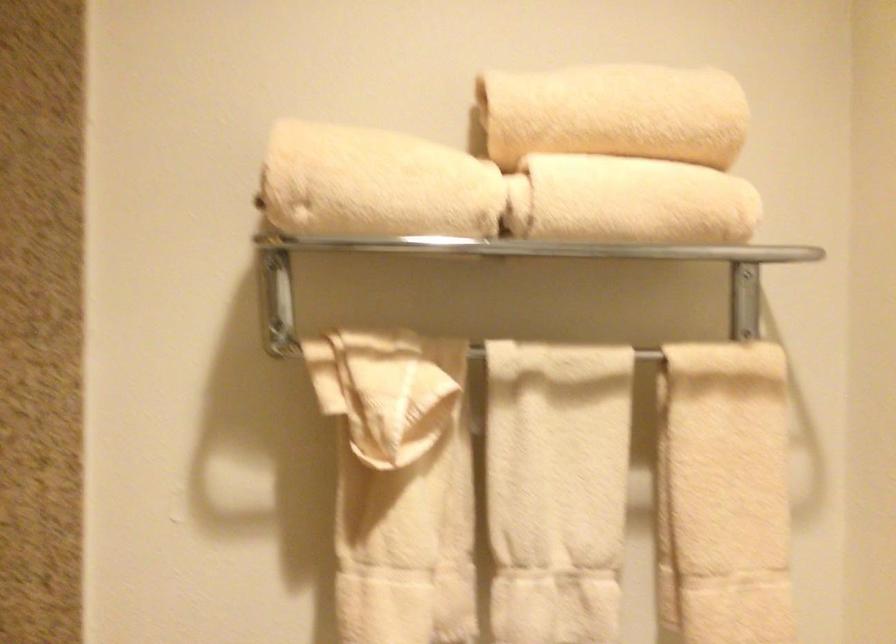
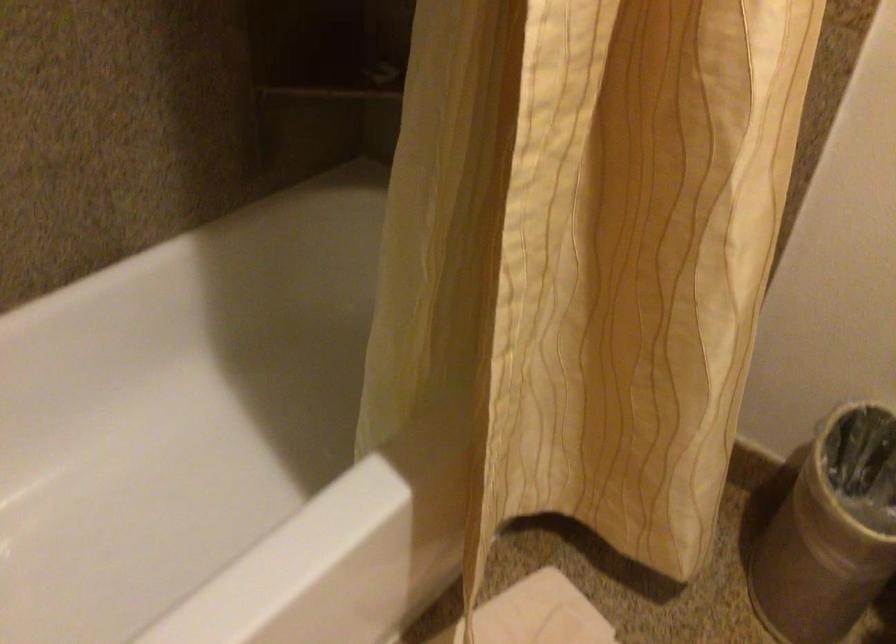
The images are taken continuously from a first-person perspective. In which direction is your viewpoint rotating?

The camera rotated toward left-down.